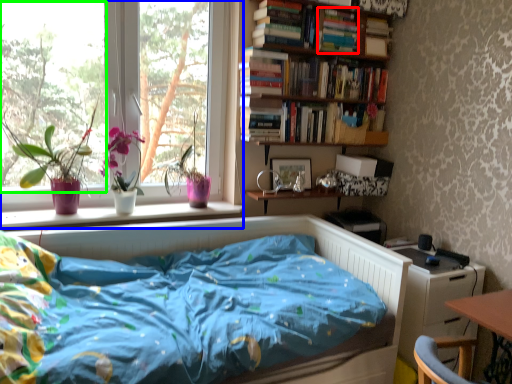
Question: Estimate the real-world distances between objects in this image. Which object is farther from book (highlighted by a red box), window (highlighted by a blue box) or window screen (highlighted by a green box)?

Choices:
 (A) window
 (B) window screen

Answer: (B)